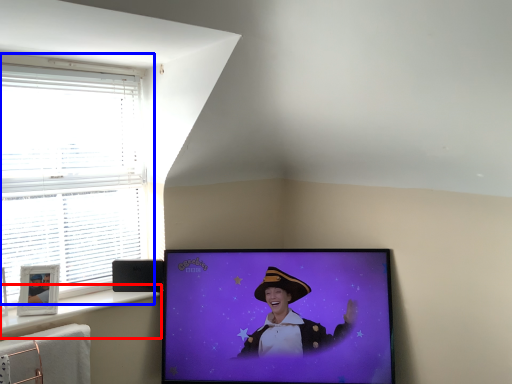
Question: Which object appears farthest to the camera in this image, window sill (highlighted by a red box) or window (highlighted by a blue box)?

Choices:
 (A) window sill
 (B) window

Answer: (B)